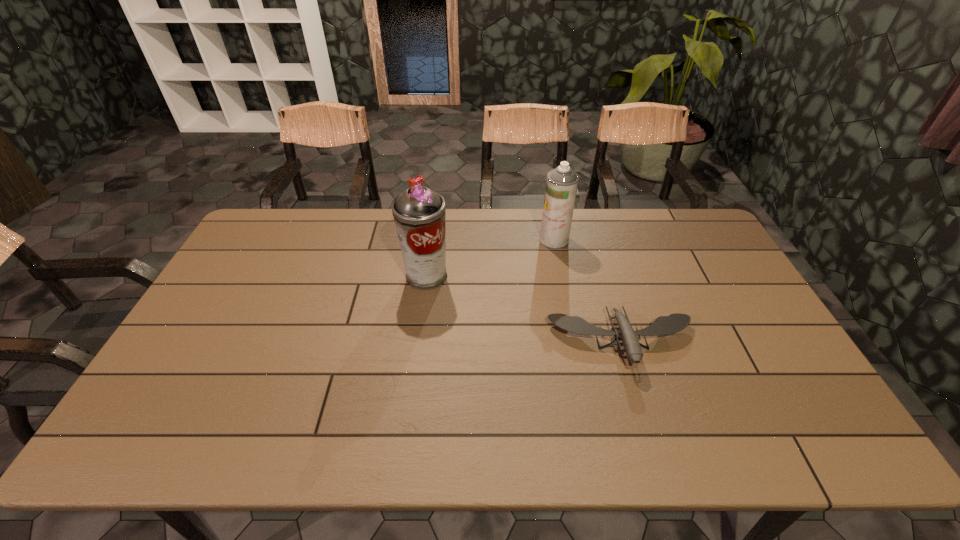
Locate an element on the screen. This screenshot has height=540, width=960. empty space between the right aerosol can and the nearest object is located at coordinates (588, 291).

At what (x,y) coordinates should I click in order to perform the action: click on vacant space that is in between the right aerosol can and the drone. Please return your answer as a coordinate pair (x, y). Image resolution: width=960 pixels, height=540 pixels. Looking at the image, I should click on (588, 291).

Where is `free space between the second shortest object and the drone`? This screenshot has width=960, height=540. free space between the second shortest object and the drone is located at coordinates [588, 291].

The height and width of the screenshot is (540, 960). Identify the location of empty location between the nearer aerosol can and the shortest object. (524, 309).

The height and width of the screenshot is (540, 960). I want to click on vacant region between the farther aerosol can and the nearest object, so click(588, 291).

You are a GUI agent. You are given a task and a screenshot of the screen. Output one action in this format:
    pyautogui.click(x=<x>, y=<y>)
    Task: Click on the vacant region between the drone and the taller aerosol can
    The height and width of the screenshot is (540, 960).
    Given the screenshot: What is the action you would take?
    pos(524,309)

I want to click on the closest object to the farthest object, so click(663, 325).

Locate which object is the closest to the drone. Please provide its 2D coordinates. Your answer should be formatted as a tuple, i.e. [(x, y)], where the tuple contains the x and y coordinates of a point satisfying the conditions above.

[(561, 184)]